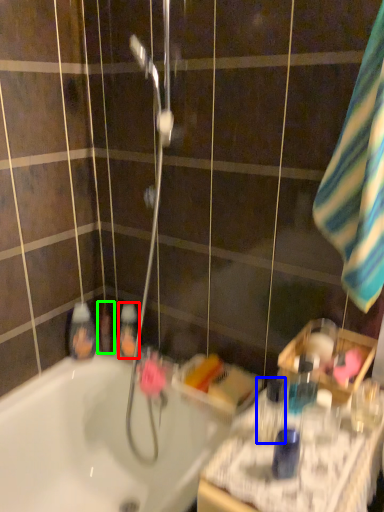
Question: Which is farther away from mouthwash (highlighted by a red box)? mouthwash (highlighted by a blue box) or mouthwash (highlighted by a green box)?

Choices:
 (A) mouthwash
 (B) mouthwash

Answer: (A)